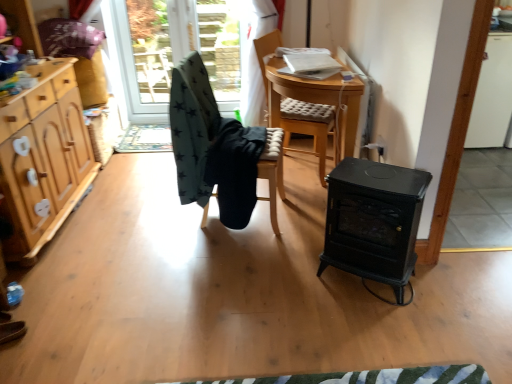
Identify the location of free point to the right of black cast iron stove at center. Image resolution: width=512 pixels, height=384 pixels. (453, 285).